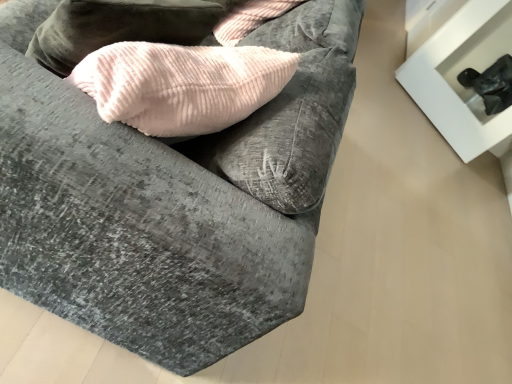
Question: Considering the relative sizes of black matte table at upper right and velvet gray couch at center in the image provided, is black matte table at upper right thinner than velvet gray couch at center?

Choices:
 (A) no
 (B) yes

Answer: (B)

Question: Is black matte table at upper right at the left side of velvet gray couch at center?

Choices:
 (A) yes
 (B) no

Answer: (B)

Question: Is black matte table at upper right not inside velvet gray couch at center?

Choices:
 (A) no
 (B) yes

Answer: (B)

Question: Considering the relative sizes of black matte table at upper right and velvet gray couch at center in the image provided, is black matte table at upper right wider than velvet gray couch at center?

Choices:
 (A) no
 (B) yes

Answer: (A)

Question: Is black matte table at upper right to the right of velvet gray couch at center from the viewer's perspective?

Choices:
 (A) no
 (B) yes

Answer: (B)

Question: Can you see black matte table at upper right touching velvet gray couch at center?

Choices:
 (A) yes
 (B) no

Answer: (B)

Question: Does velvet gray couch at center have a greater width compared to black matte table at upper right?

Choices:
 (A) no
 (B) yes

Answer: (B)

Question: Is velvet gray couch at center facing towards black matte table at upper right?

Choices:
 (A) yes
 (B) no

Answer: (B)

Question: Can you confirm if velvet gray couch at center is taller than black matte table at upper right?

Choices:
 (A) no
 (B) yes

Answer: (A)

Question: Considering the relative sizes of velvet gray couch at center and black matte table at upper right in the image provided, is velvet gray couch at center bigger than black matte table at upper right?

Choices:
 (A) yes
 (B) no

Answer: (A)

Question: Can you confirm if velvet gray couch at center is positioned to the left of black matte table at upper right?

Choices:
 (A) no
 (B) yes

Answer: (B)

Question: Is the position of velvet gray couch at center more distant than that of black matte table at upper right?

Choices:
 (A) no
 (B) yes

Answer: (A)

Question: Based on their sizes in the image, would you say velvet gray couch at center is bigger or smaller than black matte table at upper right?

Choices:
 (A) small
 (B) big

Answer: (B)